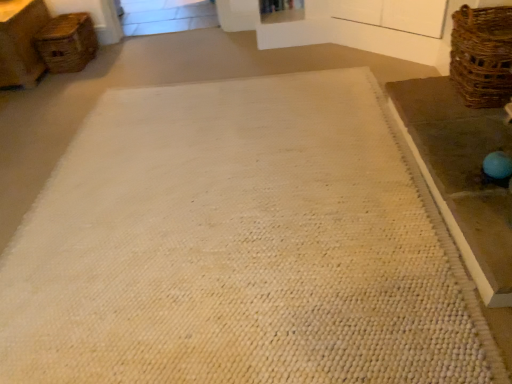
The width and height of the screenshot is (512, 384). I want to click on woven brown basket at upper left, the second basket when ordered from front to back, so click(67, 43).

This screenshot has width=512, height=384. What do you see at coordinates (461, 175) in the screenshot?
I see `brown woven table at right` at bounding box center [461, 175].

Where is `wooden shelf at upper center`? The height and width of the screenshot is (384, 512). wooden shelf at upper center is located at coordinates (281, 11).

Choose the correct answer: Is brown woven basket at right, arranged as the 2th basket when viewed from the left, inside wooden shelf at upper center or outside it?

brown woven basket at right, arranged as the 2th basket when viewed from the left, is outside wooden shelf at upper center.

Looking at this image, considering the positions of objects brown woven basket at right, the 1th basket positioned from the front, and wooden shelf at upper center in the image provided, who is behind, brown woven basket at right, the 1th basket positioned from the front, or wooden shelf at upper center?

wooden shelf at upper center.

Are brown woven basket at right, which is the 2th basket in back-to-front order, and wooden shelf at upper center making contact?

No, brown woven basket at right, which is the 2th basket in back-to-front order, is not touching wooden shelf at upper center.

Can you confirm if brown woven basket at right, which is counted as the 1th basket, starting from the right, is positioned to the right of wooden shelf at upper center?

Yes.

From a real-world perspective, which object rests below the other?

brown woven table at right.

Looking at this image, how much distance is there between brown woven table at right and woven brown basket at upper left, placed as the second basket when sorted from bottom to top?

brown woven table at right and woven brown basket at upper left, placed as the second basket when sorted from bottom to top, are 8.27 feet apart.

From the image's perspective, is brown woven table at right located above woven brown basket at upper left, the 2th basket in the right-to-left sequence?

No, from the image's perspective, brown woven table at right is not above woven brown basket at upper left, the 2th basket in the right-to-left sequence.

Which is more to the right, brown woven table at right or woven brown basket at upper left, the second basket when ordered from front to back?

brown woven table at right is more to the right.

Considering the relative positions of woven brown basket at upper left, placed as the 1th basket when sorted from back to front, and wooden shelf at upper center in the image provided, is woven brown basket at upper left, placed as the 1th basket when sorted from back to front, to the right of wooden shelf at upper center from the viewer's perspective?

No, woven brown basket at upper left, placed as the 1th basket when sorted from back to front, is not to the right of wooden shelf at upper center.

Which is less distant, (64, 45) or (288, 3)?

Point (64, 45) is positioned farther from the camera compared to point (288, 3).

Between woven brown basket at upper left, which appears as the 1th basket when viewed from the top, and wooden shelf at upper center, which one is positioned behind?

wooden shelf at upper center is behind.

Is woven brown basket at upper left, the 2th basket in the right-to-left sequence, wider or thinner than wooden shelf at upper center?

In the image, woven brown basket at upper left, the 2th basket in the right-to-left sequence, appears to be wider than wooden shelf at upper center.

From the image's perspective, does wooden shelf at upper center appear higher than woven brown basket at upper left, placed as the second basket when sorted from bottom to top?

Yes, from the image's perspective, wooden shelf at upper center is over woven brown basket at upper left, placed as the second basket when sorted from bottom to top.

Which is closer to the camera, [282,21] or [51,34]?

Clearly, point [282,21] is closer to the camera than point [51,34].

Considering the relative sizes of wooden shelf at upper center and woven brown basket at upper left, placed as the 1th basket when sorted from back to front, in the image provided, is wooden shelf at upper center shorter than woven brown basket at upper left, placed as the 1th basket when sorted from back to front,?

Indeed, wooden shelf at upper center has a lesser height compared to woven brown basket at upper left, placed as the 1th basket when sorted from back to front.

From the wooden shelf at upper center, count 1st baskets forward and point to it. Please provide its 2D coordinates.

[(67, 43)]

Looking at this image, is woven brown basket at upper left, placed as the second basket when sorted from bottom to top, thinner than brown woven table at right?

Indeed, woven brown basket at upper left, placed as the second basket when sorted from bottom to top, has a lesser width compared to brown woven table at right.

Between woven brown basket at upper left, the second basket when ordered from front to back, and brown woven table at right, which one appears on the left side from the viewer's perspective?

woven brown basket at upper left, the second basket when ordered from front to back.

Which object is closer to the camera taking this photo, woven brown basket at upper left, placed as the 1th basket when sorted from back to front, or brown woven table at right?

brown woven table at right is in front.

Is the surface of woven brown basket at upper left, the second basket when ordered from front to back, in direct contact with brown woven table at right?

No, woven brown basket at upper left, the second basket when ordered from front to back, is not in contact with brown woven table at right.

Is point (462, 75) farther from viewer compared to point (72, 66)?

No, it is in front of (72, 66).

From the image's perspective, is brown woven basket at right, which is the second basket in top-to-bottom order, on woven brown basket at upper left, placed as the second basket when sorted from bottom to top?

No, from the image's perspective, brown woven basket at right, which is the second basket in top-to-bottom order, is not above woven brown basket at upper left, placed as the second basket when sorted from bottom to top.

Considering the positions of objects brown woven basket at right, which is counted as the 1th basket, starting from the right, and woven brown basket at upper left, the second basket when ordered from front to back, in the image provided, who is behind, brown woven basket at right, which is counted as the 1th basket, starting from the right, or woven brown basket at upper left, the second basket when ordered from front to back,?

woven brown basket at upper left, the second basket when ordered from front to back, is behind.

What's the angular difference between brown woven basket at right, the 1th basket positioned from the front, and woven brown basket at upper left, placed as the second basket when sorted from bottom to top,'s facing directions?

178 degrees separate the facing orientations of brown woven basket at right, the 1th basket positioned from the front, and woven brown basket at upper left, placed as the second basket when sorted from bottom to top.

Identify the location of basket that is in front of the woven brown basket at upper left, placed as the 1th basket when sorted from back to front. (482, 55).

Does woven brown basket at upper left, placed as the second basket when sorted from bottom to top, touch brown woven basket at right, the 1th basket positioned from the front?

There is a gap between woven brown basket at upper left, placed as the second basket when sorted from bottom to top, and brown woven basket at right, the 1th basket positioned from the front.

From the image's perspective, count 2nd baskets downward from the wooden shelf at upper center and point to it. Please provide its 2D coordinates.

[(482, 55)]

Identify the location of table on the right of woven brown basket at upper left, placed as the second basket when sorted from bottom to top. This screenshot has height=384, width=512. (461, 175).

From the image, which object appears to be nearer to woven brown basket at upper left, placed as the 1th basket when sorted from left to right, wooden shelf at upper center or brown woven table at right?

Based on the image, wooden shelf at upper center appears to be nearer to woven brown basket at upper left, placed as the 1th basket when sorted from left to right.

Estimate the real-world distances between objects in this image. Which object is closer to wooden shelf at upper center, woven brown basket at upper left, placed as the 1th basket when sorted from left to right, or brown woven basket at right, arranged as the 2th basket when viewed from the left?

brown woven basket at right, arranged as the 2th basket when viewed from the left, lies closer to wooden shelf at upper center than the other object.

When comparing their distances from woven brown basket at upper left, placed as the 1th basket when sorted from left to right, does brown woven table at right or brown woven basket at right, positioned as the 1th basket in bottom-to-top order, seem further?

Based on the image, brown woven basket at right, positioned as the 1th basket in bottom-to-top order, appears to be further to woven brown basket at upper left, placed as the 1th basket when sorted from left to right.

Looking at the image, which one is located further to wooden shelf at upper center, brown woven basket at right, which is the 2th basket in back-to-front order, or woven brown basket at upper left, placed as the 1th basket when sorted from left to right?

woven brown basket at upper left, placed as the 1th basket when sorted from left to right.

Looking at the image, which one is located closer to brown woven table at right, brown woven basket at right, which is the 2th basket in back-to-front order, or woven brown basket at upper left, placed as the 1th basket when sorted from left to right?

brown woven basket at right, which is the 2th basket in back-to-front order, is closer to brown woven table at right.

Estimate the real-world distances between objects in this image. Which object is closer to brown woven basket at right, the 1th basket positioned from the front, brown woven table at right or wooden shelf at upper center?

brown woven table at right.

Estimate the real-world distances between objects in this image. Which object is closer to brown woven basket at right, which is the 2th basket in back-to-front order, wooden shelf at upper center or brown woven table at right?

brown woven table at right is closer to brown woven basket at right, which is the 2th basket in back-to-front order.

Looking at the image, which one is located closer to woven brown basket at upper left, the second basket when ordered from front to back, brown woven basket at right, positioned as the 1th basket in bottom-to-top order, or brown woven table at right?

brown woven table at right is closer to woven brown basket at upper left, the second basket when ordered from front to back.

What are the coordinates of `shelf situated between woven brown basket at upper left, the second basket when ordered from front to back, and brown woven table at right from left to right` in the screenshot? It's located at (281, 11).

This screenshot has width=512, height=384. In order to click on table between woven brown basket at upper left, placed as the 1th basket when sorted from left to right, and brown woven basket at right, positioned as the 1th basket in bottom-to-top order in this screenshot , I will do `click(461, 175)`.

What are the coordinates of `shelf between woven brown basket at upper left, the second basket when ordered from front to back, and brown woven basket at right, which is counted as the 1th basket, starting from the right, in the horizontal direction` in the screenshot? It's located at (281, 11).